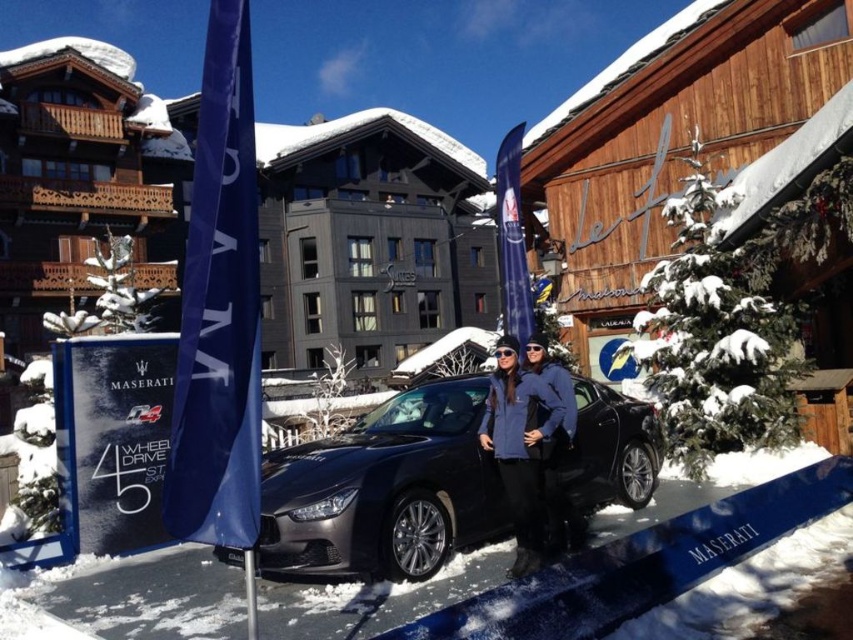
Question: Which of the following is the farthest from the observer?

Choices:
 (A) blue fabric flag at left
 (B) blue fabric jacket at center
 (C) satin black car at center

Answer: (B)

Question: Does satin black car at center have a greater width compared to blue fabric flag at center?

Choices:
 (A) no
 (B) yes

Answer: (A)

Question: Is blue fabric flag at left closer to camera compared to blue fabric jacket at center?

Choices:
 (A) no
 (B) yes

Answer: (B)

Question: Which object is positioned farthest from the blue fabric flag at center?

Choices:
 (A) blue fabric jacket at center
 (B) blue fabric flag at left

Answer: (B)

Question: Considering the real-world distances, which object is closest to the satin black car at center?

Choices:
 (A) blue fabric flag at left
 (B) blue fabric flag at center
 (C) blue fabric jacket at center

Answer: (C)

Question: Where is satin black car at center located in relation to blue fabric flag at center in the image?

Choices:
 (A) right
 (B) left

Answer: (B)